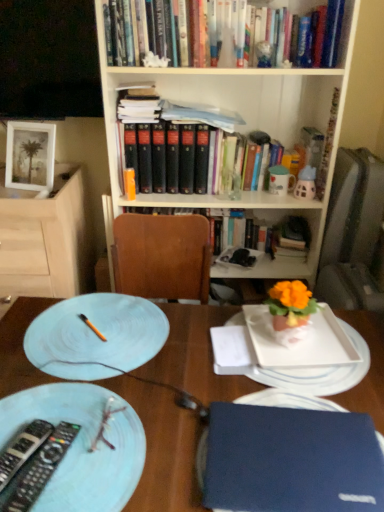
Describe the element at coordinates (291, 460) in the screenshot. Image resolution: width=384 pixels, height=512 pixels. I see `blue hardcover book at lower right` at that location.

What do you see at coordinates (46, 239) in the screenshot?
I see `matte white plate at left` at bounding box center [46, 239].

Measure the distance between point (39, 488) and camera.

A distance of 29.37 inches exists between point (39, 488) and camera.

Identify the location of blue matte laptop at lower right. This screenshot has width=384, height=512. (162, 447).

This screenshot has height=512, width=384. Identify the location of blue hardcover book at lower right. (291, 460).

Identify the location of the 2nd plate counting from the right of the white matte picture frame at upper left. (96, 336).

Measure the distance between light blue ceramic plate at center-left, which appears as the second plate when viewed from the front, and white matte picture frame at upper left.

light blue ceramic plate at center-left, which appears as the second plate when viewed from the front, and white matte picture frame at upper left are 84.11 centimeters apart.

From a real-world perspective, does light blue ceramic plate at center-left, which appears as the second plate when viewed from the front, sit lower than white matte picture frame at upper left?

Yes.

Is light blue ceramic plate at center-left, the second plate from the bottom, facing towards white matte picture frame at upper left?

No, light blue ceramic plate at center-left, the second plate from the bottom, is not aimed at white matte picture frame at upper left.

From a real-world perspective, is black plastic remote control at lower left physically located above or below wooden bookcase at upper center?

From a real-world perspective, black plastic remote control at lower left is physically below wooden bookcase at upper center.

Is black plastic remote control at lower left beside wooden bookcase at upper center?

black plastic remote control at lower left is not next to wooden bookcase at upper center, and they're not touching.

Can you confirm if black plastic remote control at lower left is shorter than wooden bookcase at upper center?

Correct, black plastic remote control at lower left is not as tall as wooden bookcase at upper center.

From the image's perspective, is black plastic remote control at lower left beneath wooden bookcase at upper center?

Correct, black plastic remote control at lower left appears lower than wooden bookcase at upper center in the image.

In the scene shown: Could you tell me if white matte picture frame at upper left is turned towards blue glossy plate at lower left, which is the 2th plate in top-to-bottom order?

No, white matte picture frame at upper left is not aimed at blue glossy plate at lower left, which is the 2th plate in top-to-bottom order.

Based on the photo, from the image's perspective, is white matte picture frame at upper left located above or below blue glossy plate at lower left, which is the 2th plate in top-to-bottom order?

white matte picture frame at upper left is situated higher than blue glossy plate at lower left, which is the 2th plate in top-to-bottom order, in the image.

What's the angular difference between white matte picture frame at upper left and blue glossy plate at lower left, which is counted as the 1th plate, starting from the front,'s facing directions?

There is a 77.3-degree angle between the facing directions of white matte picture frame at upper left and blue glossy plate at lower left, which is counted as the 1th plate, starting from the front.

Is white matte picture frame at upper left next to blue glossy plate at lower left, which is the 2th plate in top-to-bottom order?

white matte picture frame at upper left is not next to blue glossy plate at lower left, which is the 2th plate in top-to-bottom order, and they're not touching.

In terms of size, does blue hardcover book at lower right appear bigger or smaller than blue matte laptop at lower right?

Clearly, blue hardcover book at lower right is smaller in size than blue matte laptop at lower right.

From the image's perspective, is blue hardcover book at lower right on top of blue matte laptop at lower right?

Yes.

Would you say blue hardcover book at lower right is inside or outside blue matte laptop at lower right?

blue hardcover book at lower right is contained in blue matte laptop at lower right.

Can you confirm if blue hardcover book at lower right is thinner than blue matte laptop at lower right?

Yes.

Does point (16, 404) come closer to viewer compared to point (296, 495)?

That is False.

Considering the relative sizes of blue glossy plate at lower left, positioned as the second plate in back-to-front order, and blue hardcover book at lower right in the image provided, is blue glossy plate at lower left, positioned as the second plate in back-to-front order, thinner than blue hardcover book at lower right?

In fact, blue glossy plate at lower left, positioned as the second plate in back-to-front order, might be wider than blue hardcover book at lower right.

Between blue glossy plate at lower left, positioned as the second plate in back-to-front order, and blue hardcover book at lower right, which one is positioned behind?

blue hardcover book at lower right is more distant.

Image resolution: width=384 pixels, height=512 pixels. In the image, there is a blue hardcover book at lower right. In order to click on plate above it (from the image's perspective) in this screenshot , I will do `click(96, 336)`.

From a real-world perspective, which object rests below the other?

light blue ceramic plate at center-left, the first plate from the top, from a real-world perspective.

Can you confirm if blue hardcover book at lower right is taller than light blue ceramic plate at center-left, which appears as the second plate when viewed from the front?

Indeed, blue hardcover book at lower right has a greater height compared to light blue ceramic plate at center-left, which appears as the second plate when viewed from the front.

From the picture: How many degrees apart are the facing directions of blue hardcover book at lower right and light blue ceramic plate at center-left, which appears as the second plate when viewed from the front?

0.596 degrees separate the facing orientations of blue hardcover book at lower right and light blue ceramic plate at center-left, which appears as the second plate when viewed from the front.

Find the location of `shelf in front of the white matte picture frame at upper left`. shelf in front of the white matte picture frame at upper left is located at coordinates (46, 239).

Consider the image. Which is behind, white matte picture frame at upper left or matte white plate at left?

Positioned behind is white matte picture frame at upper left.

In the scene shown: Considering the relative sizes of white matte picture frame at upper left and matte white plate at left in the image provided, is white matte picture frame at upper left thinner than matte white plate at left?

Yes, white matte picture frame at upper left is thinner than matte white plate at left.

Is white matte picture frame at upper left not near matte white plate at left?

No, white matte picture frame at upper left is not far from matte white plate at left.

The width and height of the screenshot is (384, 512). What are the coordinates of `plate that is the 2nd object to the right of the white matte picture frame at upper left, starting at the anchor` in the screenshot? It's located at (96, 336).

In order to click on bookcase above the black plastic remote control at lower left (from the image's perspective) in this screenshot , I will do (x=239, y=129).

Estimate the real-world distances between objects in this image. Which object is closer to white glossy platter at center, matte ceramic mug at upper right or white matte picture frame at upper left?

The object closer to white glossy platter at center is matte ceramic mug at upper right.

Looking at the image, which one is located further to blue matte laptop at lower right, white glossy platter at center or matte white plate at left?

matte white plate at left is further to blue matte laptop at lower right.

When comparing their distances from white glossy platter at center, does blue glossy plate at lower left, arranged as the 1th plate when ordered from the bottom, or matte white plate at left seem further?

The object further to white glossy platter at center is matte white plate at left.

Looking at this image, estimate the real-world distances between objects in this image. Which object is closer to matte white plate at left, light blue ceramic plate at center-left, the first plate from the top, or matte ceramic mug at upper right?

light blue ceramic plate at center-left, the first plate from the top, is positioned closer to the anchor matte white plate at left.

Estimate the real-world distances between objects in this image. Which object is further from white glossy platter at center, matte white plate at left or matte ceramic mug at upper right?

Among the two, matte white plate at left is located further to white glossy platter at center.

Based on their spatial positions, is matte white plate at left or black plastic remote control at lower left further from matte ceramic mug at upper right?

The object further to matte ceramic mug at upper right is black plastic remote control at lower left.

Looking at the image, which one is located closer to white matte picture frame at upper left, matte ceramic mug at upper right or light blue ceramic plate at center-left, which appears as the second plate when viewed from the front?

light blue ceramic plate at center-left, which appears as the second plate when viewed from the front, is closer to white matte picture frame at upper left.

From the image, which object appears to be nearer to white glossy platter at center, blue glossy plate at lower left, arranged as the 1th plate when ordered from the bottom, or blue matte laptop at lower right?

The object closer to white glossy platter at center is blue matte laptop at lower right.

Find the location of a particular element. This screenshot has width=384, height=512. plate between blue hardcover book at lower right and white matte picture frame at upper left from front to back is located at coordinates (96, 336).

This screenshot has height=512, width=384. I want to click on remote control positioned between blue hardcover book at lower right and white matte picture frame at upper left from near to far, so click(x=41, y=468).

Where is `desk between blue glossy plate at lower left, which is counted as the 1th plate, starting from the front, and white glossy platter at center`? Image resolution: width=384 pixels, height=512 pixels. desk between blue glossy plate at lower left, which is counted as the 1th plate, starting from the front, and white glossy platter at center is located at coordinates (162, 447).

In order to click on remote control positioned between blue glossy plate at lower left, arranged as the 1th plate when ordered from the bottom, and light blue ceramic plate at center-left, which appears as the second plate when viewed from the front, from near to far in this screenshot , I will do `click(41, 468)`.